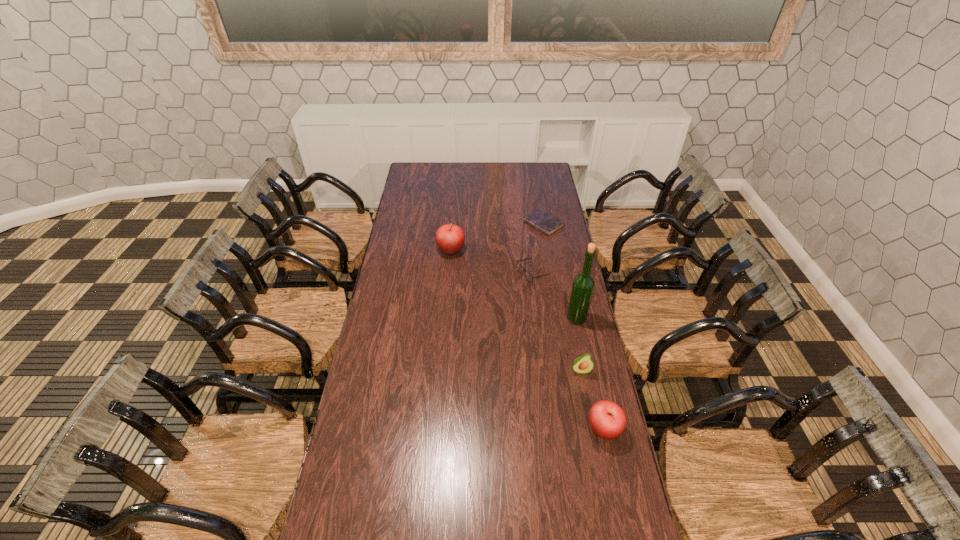
You are a GUI agent. You are given a task and a screenshot of the screen. Output one action in this format:
    pyautogui.click(x=<x>, y=<y>)
    Task: Click on the free point between the fifth nearest object and the liquor
    This screenshot has width=960, height=540.
    Given the screenshot: What is the action you would take?
    pyautogui.click(x=514, y=285)

You are a GUI agent. You are given a task and a screenshot of the screen. Output one action in this format:
    pyautogui.click(x=<x>, y=<y>)
    Task: Click on the free space between the taller apple and the shortest object
    
    Given the screenshot: What is the action you would take?
    pyautogui.click(x=497, y=238)

Identify the location of free space that is in between the tallest object and the diary. (560, 271).

Identify the location of free space between the right apple and the avocado. The image size is (960, 540). (592, 400).

Where is `free space between the left apple and the third farthest object`? This screenshot has height=540, width=960. free space between the left apple and the third farthest object is located at coordinates (492, 262).

Where is `vacant area that lies between the nearer apple and the left apple`? The image size is (960, 540). vacant area that lies between the nearer apple and the left apple is located at coordinates (527, 340).

Image resolution: width=960 pixels, height=540 pixels. I want to click on vacant space in between the second shortest object and the diary, so click(538, 249).

The width and height of the screenshot is (960, 540). In order to click on unoccupied area between the taller apple and the fourth nearest object in this screenshot , I will do `click(492, 262)`.

Find the location of a particular element. The height and width of the screenshot is (540, 960). free space between the diary and the fifth tallest object is located at coordinates (538, 249).

Find the location of a particular element. free space between the tallest object and the left apple is located at coordinates (514, 285).